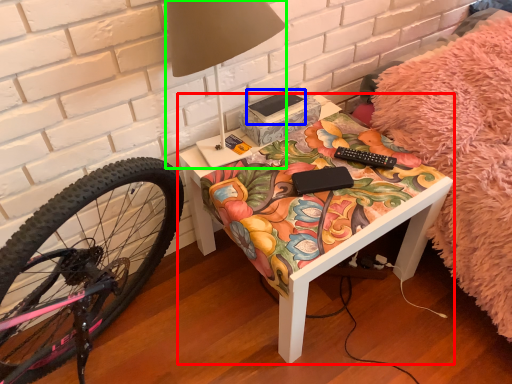
Question: Which object is positioned closest to table (highlighted by a red box)? Select from book (highlighted by a blue box) and table lamp (highlighted by a green box).

Choices:
 (A) book
 (B) table lamp

Answer: (A)